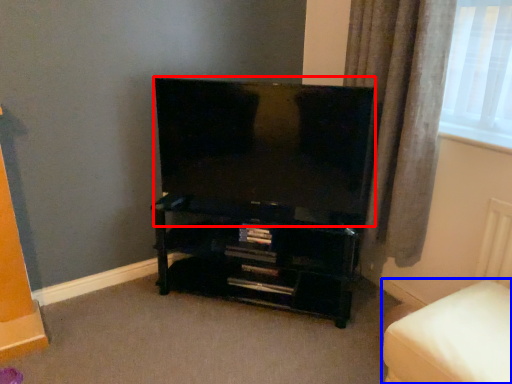
Question: Which object appears closest to the camera in this image, television (highlighted by a red box) or furniture (highlighted by a blue box)?

Choices:
 (A) television
 (B) furniture

Answer: (B)